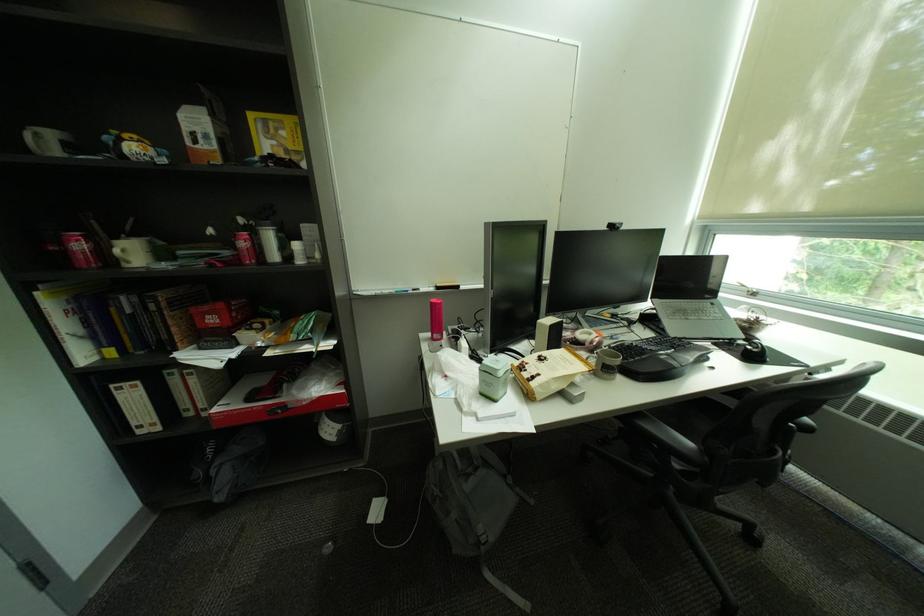
I want to click on white plastic bottle, so click(x=270, y=244).